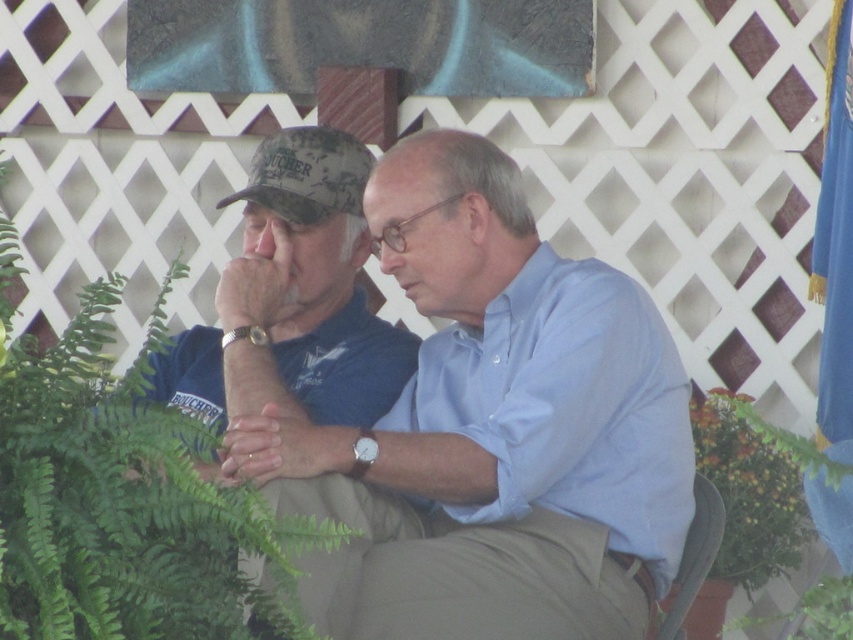
In the scene shown: You are standing in front of the two people in the image and want to take a photo. You notice two points marked in the scene. Which point, point (628, 333) or point (345, 205), is closer to you?

Point (628, 333) is closer to you than point (345, 205).

You are a photographer trying to capture a clear shot of the camouflage fabric baseball cap at left and the green leafy plant at left. Based on their positions, which object is closer to the camera?

The green leafy plant at left is located below the camouflage fabric baseball cap at left, so the camouflage fabric baseball cap at left is closer to the camera.